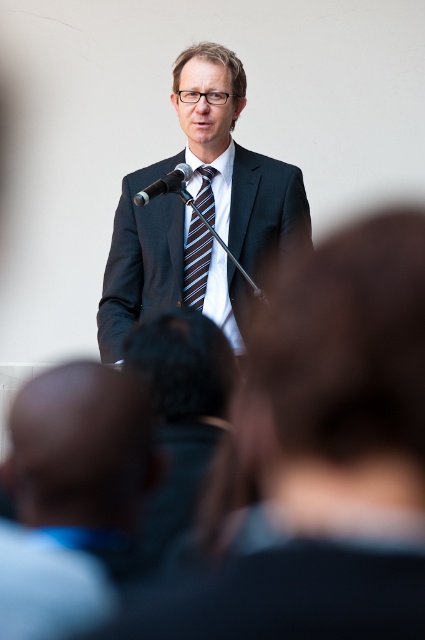
Question: Is dark blue suit at center smaller than brown striped tie at center?

Choices:
 (A) no
 (B) yes

Answer: (A)

Question: Which object is positioned farthest from the brown striped tie at center?

Choices:
 (A) dark blue suit at center
 (B) black metallic microphone at upper center

Answer: (B)

Question: Is dark blue suit at center thinner than black metallic microphone at upper center?

Choices:
 (A) no
 (B) yes

Answer: (A)

Question: Is dark blue suit at center closer to the viewer compared to black metallic microphone at upper center?

Choices:
 (A) yes
 (B) no

Answer: (B)

Question: Which object is the farthest from the brown striped tie at center?

Choices:
 (A) dark blue suit at center
 (B) black metallic microphone at upper center

Answer: (B)

Question: Estimate the real-world distances between objects in this image. Which object is closer to the black metallic microphone at upper center?

Choices:
 (A) brown striped tie at center
 (B) dark blue suit at center

Answer: (A)